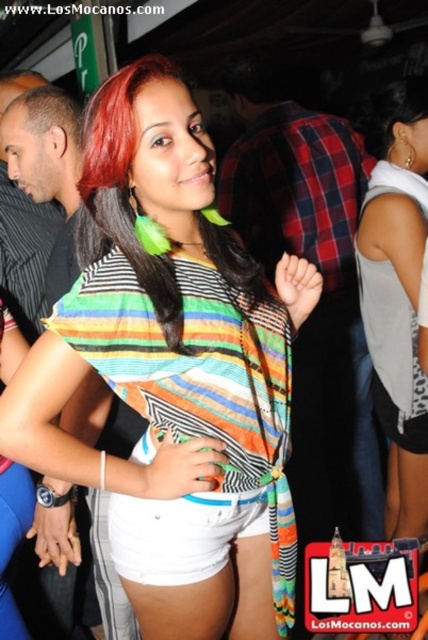
Question: Does multicolored fabric scarf at center have a lesser width compared to brushed metal watch at upper left?

Choices:
 (A) no
 (B) yes

Answer: (A)

Question: From the image, what is the correct spatial relationship of plaid fabric shirt at center in relation to multicolored fabric hair at center?

Choices:
 (A) right
 (B) left

Answer: (A)

Question: Where is gray fabric tank top at center located in relation to multicolored fabric hair at center in the image?

Choices:
 (A) left
 (B) right

Answer: (B)

Question: Considering the real-world distances, which object is closest to the plaid fabric shirt at center?

Choices:
 (A) gray fabric tank top at center
 (B) white fabric shorts at lower center
 (C) multicolored fabric hair at center

Answer: (A)

Question: Among these points, which one is nearest to the camera?

Choices:
 (A) (326, 433)
 (B) (146, 252)
 (C) (389, 420)

Answer: (B)

Question: Among these objects, which one is farthest from the camera?

Choices:
 (A) gray fabric tank top at center
 (B) white fabric shorts at lower center
 (C) plaid fabric shirt at center
 (D) multicolored fabric scarf at center

Answer: (C)